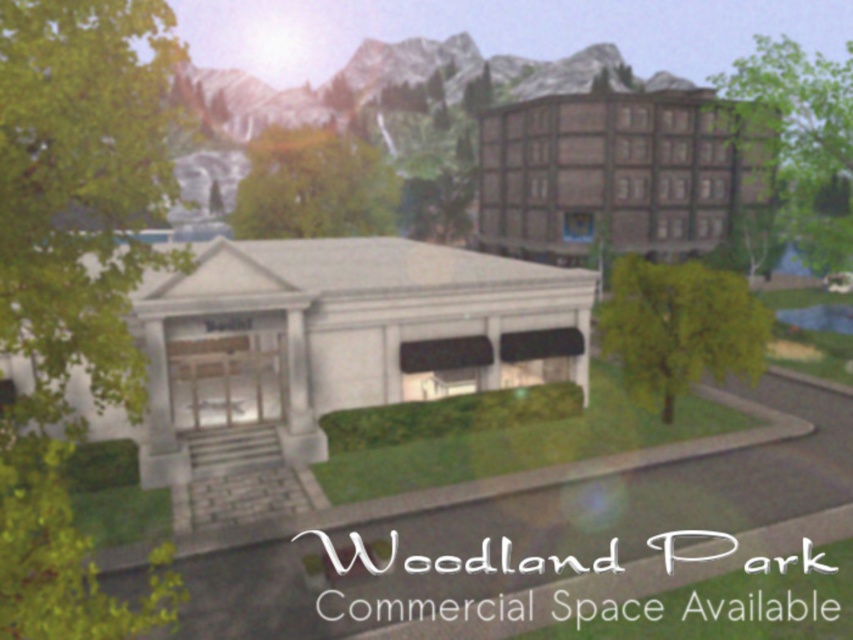
Question: Which point appears farthest from the camera in this image?

Choices:
 (A) (196, 404)
 (B) (299, 145)
 (C) (529, 172)
 (D) (685, 362)

Answer: (C)

Question: Is white marble building at center bigger than green leafy tree at center right?

Choices:
 (A) yes
 (B) no

Answer: (A)

Question: Is green leafy tree at left to the left of green leafy tree at center right from the viewer's perspective?

Choices:
 (A) no
 (B) yes

Answer: (B)

Question: Which object is the farthest from the green leafy tree at upper right?

Choices:
 (A) green leafy tree at left
 (B) brown wooden hotel at upper right
 (C) green leafy tree at center right
 (D) green leafy tree at center

Answer: (A)

Question: Does green leafy tree at left appear on the right side of green leafy tree at center?

Choices:
 (A) yes
 (B) no

Answer: (B)

Question: Which of the following is the farthest from the observer?

Choices:
 (A) brown wooden hotel at upper right
 (B) green leafy tree at left
 (C) green leafy tree at upper right

Answer: (A)